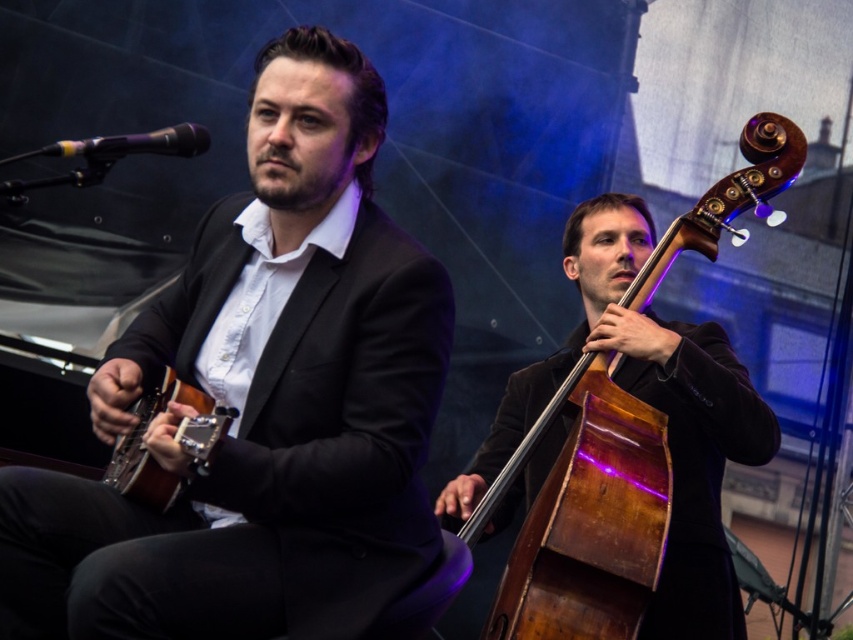
Who is shorter, matte black suit at center or wooden polished cello at right?

matte black suit at center is shorter.

Is matte black suit at center taller than wooden polished cello at right?

No, matte black suit at center is not taller than wooden polished cello at right.

Is point (88, 522) positioned behind point (573, 465)?

No.

Locate an element on the screen. matte black suit at center is located at coordinates (260, 401).